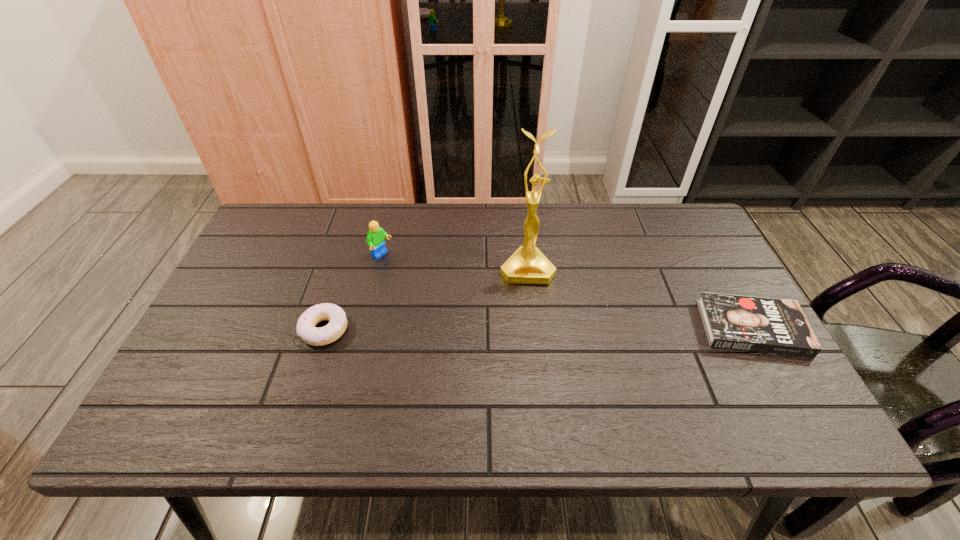
Locate an element on the screen. free point between the second object from right to left and the third tallest object is located at coordinates tap(426, 299).

This screenshot has height=540, width=960. I want to click on empty space that is in between the leftmost object and the second object from left to right, so click(353, 293).

The height and width of the screenshot is (540, 960). In order to click on free point between the award and the shortest object in this screenshot , I will do `click(639, 298)`.

Image resolution: width=960 pixels, height=540 pixels. I want to click on empty space between the Lego and the tallest object, so click(454, 262).

Image resolution: width=960 pixels, height=540 pixels. I want to click on vacant space in between the tallest object and the third tallest object, so coord(426,299).

Where is `vacant space that is in between the shortest object and the second object from left to right`? This screenshot has width=960, height=540. vacant space that is in between the shortest object and the second object from left to right is located at coordinates (567, 292).

Locate an element on the screen. The image size is (960, 540). the second closest object to the book is located at coordinates (375, 239).

You are a GUI agent. You are given a task and a screenshot of the screen. Output one action in this format:
    pyautogui.click(x=<x>, y=<y>)
    Task: Click on the object that is the third closest one to the shortest object
    Image resolution: width=960 pixels, height=540 pixels.
    Given the screenshot: What is the action you would take?
    pyautogui.click(x=306, y=329)